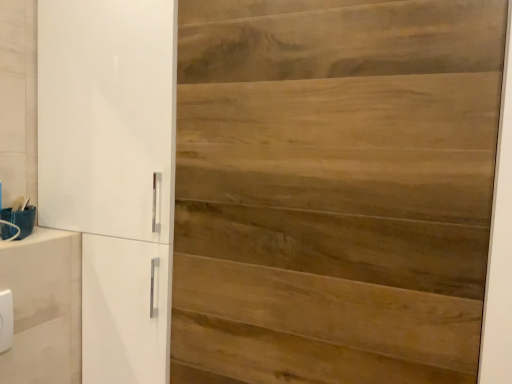
Question: From the image's perspective, is white plastic/light switch at lower left above or below white glossy cupboard at left?

Choices:
 (A) below
 (B) above

Answer: (A)

Question: Which is correct: white plastic/light switch at lower left is inside white glossy cupboard at left, or outside of it?

Choices:
 (A) outside
 (B) inside

Answer: (A)

Question: Which object is the closest to the wooden door at center?

Choices:
 (A) white glossy cupboard at left
 (B) white plastic/light switch at lower left

Answer: (A)

Question: Which of these objects is positioned farthest from the wooden door at center?

Choices:
 (A) white glossy cupboard at left
 (B) white plastic/light switch at lower left

Answer: (B)